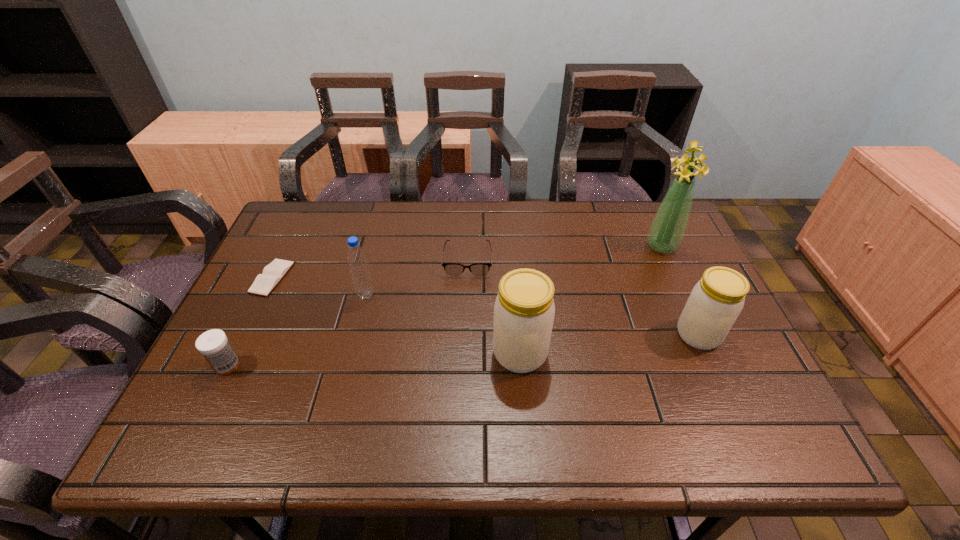
What are the coordinates of `the taller jar` in the screenshot? It's located at (524, 310).

Find the location of a particular element. Image resolution: width=960 pixels, height=540 pixels. the shorter jar is located at coordinates (716, 301).

Locate an element on the screen. Image resolution: width=960 pixels, height=540 pixels. bouquet is located at coordinates (667, 230).

You are a GUI agent. You are given a task and a screenshot of the screen. Output one action in this format:
    pyautogui.click(x=<x>, y=<y>)
    Task: Click on the water bottle
    Image resolution: width=960 pixels, height=540 pixels.
    Given the screenshot: What is the action you would take?
    tap(357, 260)

The width and height of the screenshot is (960, 540). What are the coordinates of `the shortest object` in the screenshot? It's located at (273, 273).

What are the coordinates of `the third shortest object` in the screenshot? It's located at tap(213, 344).

The image size is (960, 540). I want to click on spectacles, so click(453, 269).

This screenshot has width=960, height=540. I want to click on vacant space situated 0.100m on the back of the taller jar, so click(516, 302).

I want to click on free space located 0.070m on the front of the shorter jar, so click(718, 377).

I want to click on vacant position located on the front-facing side of the tallest object, so click(676, 278).